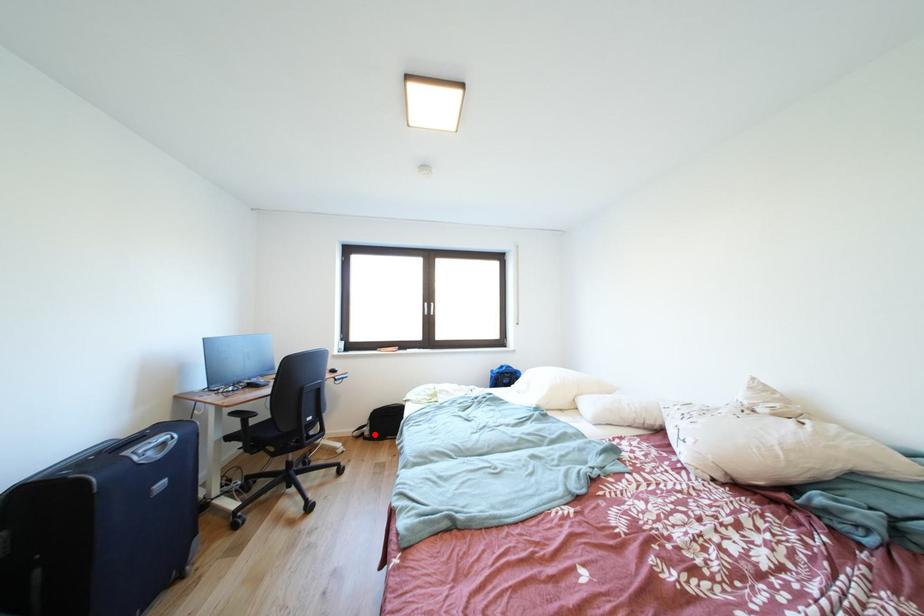
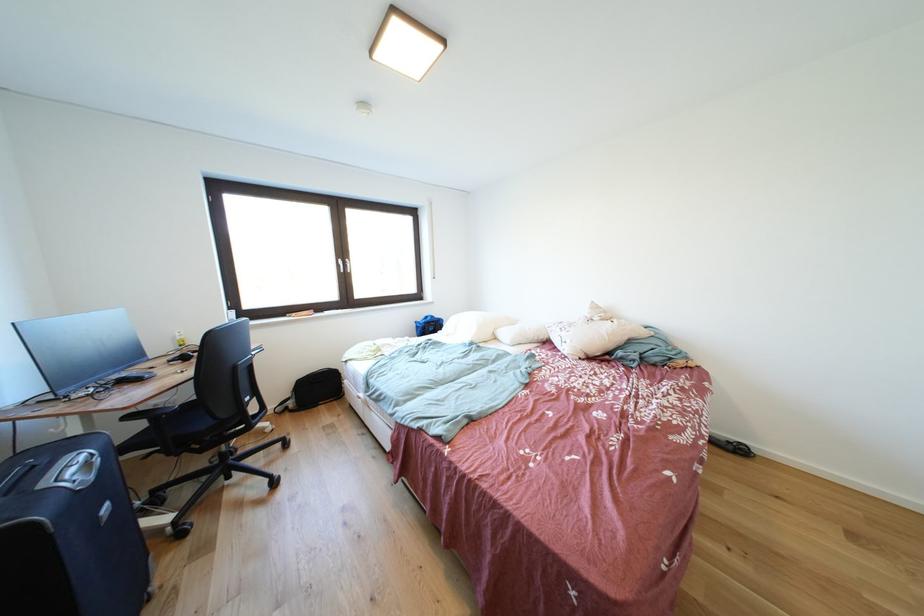
The point at the highlighted location is marked in the first image. Where is the corresponding point in the second image?

(299, 408)